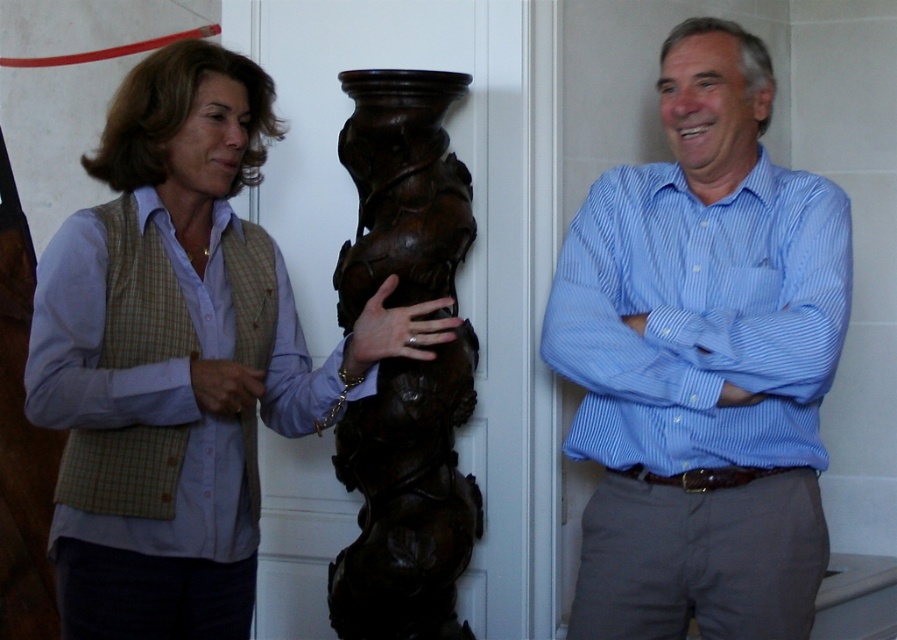
Question: Can you confirm if brown polished wood column at center is positioned below light blue cotton shirt at left?

Choices:
 (A) yes
 (B) no

Answer: (A)

Question: Can you confirm if blue striped shirt at center is smaller than brown polished wood column at center?

Choices:
 (A) no
 (B) yes

Answer: (A)

Question: Can you confirm if blue striped shirt at center is thinner than brown polished wood column at center?

Choices:
 (A) yes
 (B) no

Answer: (B)

Question: Which of the following is the farthest from the observer?

Choices:
 (A) (172, 248)
 (B) (457, 262)
 (C) (715, 442)

Answer: (B)

Question: Which of these objects is positioned farthest from the light blue cotton shirt at left?

Choices:
 (A) brown polished wood column at center
 (B) blue striped shirt at center

Answer: (A)

Question: Which of these objects is positioned closest to the light blue cotton shirt at left?

Choices:
 (A) blue striped shirt at center
 (B) brown polished wood column at center

Answer: (A)